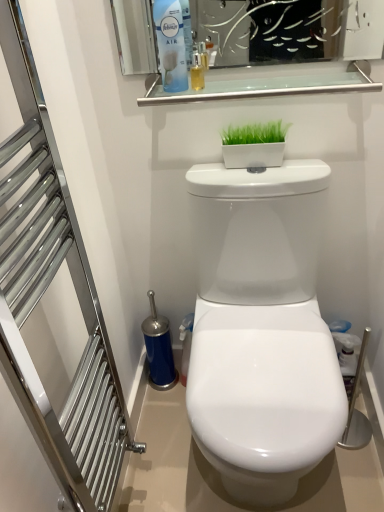
Question: Choose the correct answer: Is brushed metal towel rack at left inside clear glass shelf at upper center or outside it?

Choices:
 (A) inside
 (B) outside

Answer: (B)

Question: In terms of size, does brushed metal towel rack at left appear bigger or smaller than clear glass shelf at upper center?

Choices:
 (A) big
 (B) small

Answer: (A)

Question: Which object is the farthest from the brushed metal towel rack at left?

Choices:
 (A) blue plastic air freshener at upper center
 (B) clear glass shelf at upper center
 (C) white glossy rectangular planter at upper center

Answer: (C)

Question: Which of these objects is positioned closest to the clear glass shelf at upper center?

Choices:
 (A) blue plastic air freshener at upper center
 (B) brushed metal towel rack at left
 (C) white glossy rectangular planter at upper center

Answer: (C)